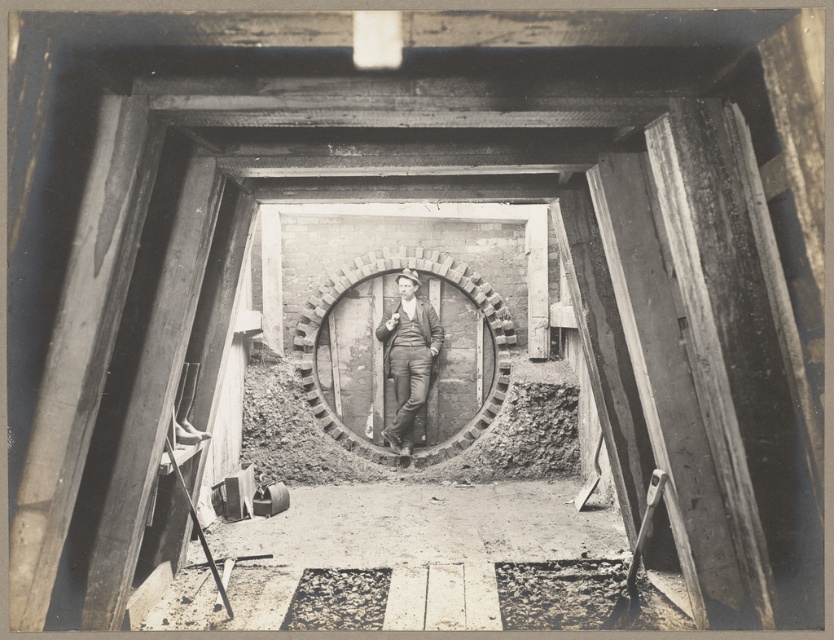
Question: Which object appears closest to the camera in this image?

Choices:
 (A) brick at center
 (B) matte black suit at center

Answer: (A)

Question: Does brick at center lie in front of matte black suit at center?

Choices:
 (A) no
 (B) yes

Answer: (B)

Question: Which of the following is the closest to the observer?

Choices:
 (A) matte black suit at center
 (B) brick at center

Answer: (B)

Question: Is brick at center thinner than matte black suit at center?

Choices:
 (A) yes
 (B) no

Answer: (B)

Question: Does brick at center have a lesser width compared to matte black suit at center?

Choices:
 (A) no
 (B) yes

Answer: (A)

Question: Among these points, which one is farthest from the camera?

Choices:
 (A) (478, 278)
 (B) (413, 381)

Answer: (A)